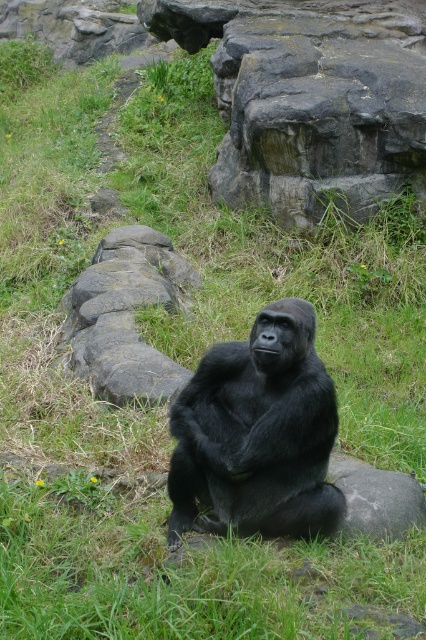
Question: Which point is closer to the camera?

Choices:
 (A) rough textured rock at upper center
 (B) black fur gorilla at center
 (C) gray rough stone at center

Answer: (B)

Question: Does rough textured rock at upper center come behind gray rough stone at center?

Choices:
 (A) yes
 (B) no

Answer: (A)

Question: Observing the image, what is the correct spatial positioning of rough textured rock at upper center in reference to black fur gorilla at center?

Choices:
 (A) left
 (B) right

Answer: (B)

Question: Among these points, which one is nearest to the camera?

Choices:
 (A) click(158, 3)
 (B) click(166, 243)
 (C) click(253, 440)

Answer: (C)

Question: Which point is closer to the camera?

Choices:
 (A) black fur gorilla at center
 (B) gray rough stone at center

Answer: (A)

Question: Can you confirm if rough textured rock at upper center is bigger than black fur gorilla at center?

Choices:
 (A) yes
 (B) no

Answer: (A)